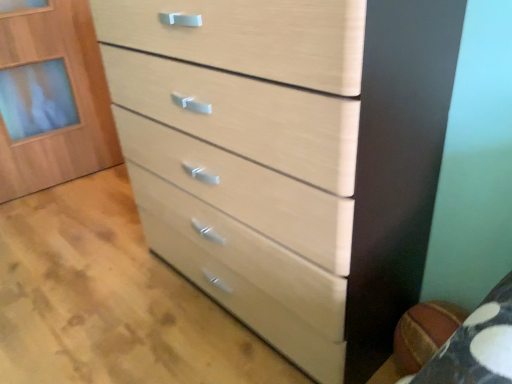
Question: Considering the relative positions of light wood cabinet at upper left and light wood/texture chest of drawers at center in the image provided, is light wood cabinet at upper left in front of light wood/texture chest of drawers at center?

Choices:
 (A) yes
 (B) no

Answer: (B)

Question: Is light wood cabinet at upper left bigger than light wood/texture chest of drawers at center?

Choices:
 (A) no
 (B) yes

Answer: (A)

Question: Can we say light wood cabinet at upper left lies outside light wood/texture chest of drawers at center?

Choices:
 (A) yes
 (B) no

Answer: (A)

Question: Is light wood cabinet at upper left turned away from light wood/texture chest of drawers at center?

Choices:
 (A) no
 (B) yes

Answer: (A)

Question: From the image's perspective, is light wood cabinet at upper left below light wood/texture chest of drawers at center?

Choices:
 (A) no
 (B) yes

Answer: (A)

Question: Is light wood drawer at center spatially inside light wood/texture chest of drawers at center, or outside of it?

Choices:
 (A) outside
 (B) inside

Answer: (A)

Question: From a real-world perspective, relative to light wood/texture chest of drawers at center, is light wood drawer at center vertically above or below?

Choices:
 (A) above
 (B) below

Answer: (B)

Question: Considering the positions of light wood drawer at center and light wood/texture chest of drawers at center in the image, is light wood drawer at center wider or thinner than light wood/texture chest of drawers at center?

Choices:
 (A) wide
 (B) thin

Answer: (A)

Question: From the image's perspective, is light wood drawer at center located above or below light wood/texture chest of drawers at center?

Choices:
 (A) above
 (B) below

Answer: (B)

Question: From a real-world perspective, is light wood cabinet at upper left above or below light wood drawer at center?

Choices:
 (A) below
 (B) above

Answer: (B)

Question: In the image, is light wood cabinet at upper left on the left side or the right side of light wood drawer at center?

Choices:
 (A) right
 (B) left

Answer: (B)

Question: Considering the positions of light wood cabinet at upper left and light wood drawer at center in the image, is light wood cabinet at upper left taller or shorter than light wood drawer at center?

Choices:
 (A) short
 (B) tall

Answer: (B)

Question: From the image's perspective, is light wood cabinet at upper left positioned above or below light wood drawer at center?

Choices:
 (A) above
 (B) below

Answer: (A)

Question: Considering the relative positions of light wood/texture chest of drawers at center and light wood cabinet at upper left in the image provided, is light wood/texture chest of drawers at center to the left or to the right of light wood cabinet at upper left?

Choices:
 (A) left
 (B) right

Answer: (B)

Question: Is light wood/texture chest of drawers at center in front of or behind light wood cabinet at upper left in the image?

Choices:
 (A) front
 (B) behind

Answer: (A)